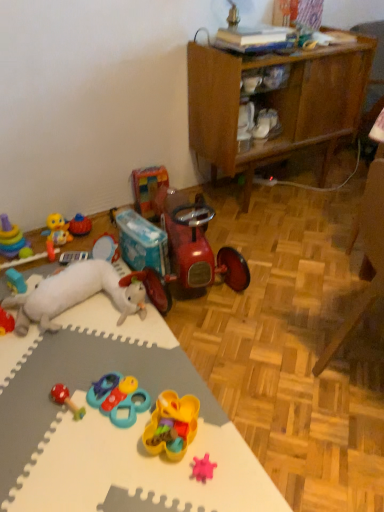
You are a GUI agent. You are given a task and a screenshot of the screen. Output one action in this format:
    pyautogui.click(x=<x>, y=<y>)
    Task: Click on the free space in front of rubberized red and green toy at lower left, the 6th toy positioned from the right
    The height and width of the screenshot is (512, 384).
    Given the screenshot: What is the action you would take?
    pyautogui.click(x=60, y=457)